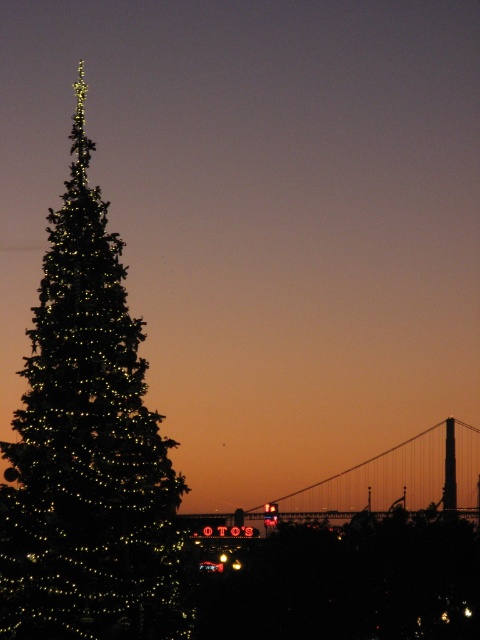
Can you confirm if illuminated matte green christmas tree at left is shorter than metallic bridge at center?

Incorrect, illuminated matte green christmas tree at left's height does not fall short of metallic bridge at center's.

Can you confirm if illuminated matte green christmas tree at left is smaller than metallic bridge at center?

Yes, illuminated matte green christmas tree at left is smaller than metallic bridge at center.

Measure the distance between illuminated matte green christmas tree at left and camera.

54.23 meters

Identify the location of illuminated matte green christmas tree at left. (87, 449).